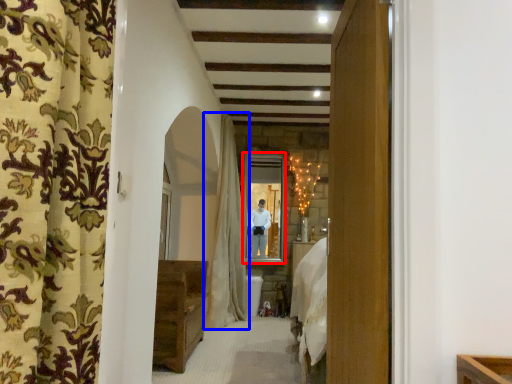
Question: Which of the following is the closest to the observer, window (highlighted by a red box) or curtain (highlighted by a blue box)?

Choices:
 (A) window
 (B) curtain

Answer: (B)